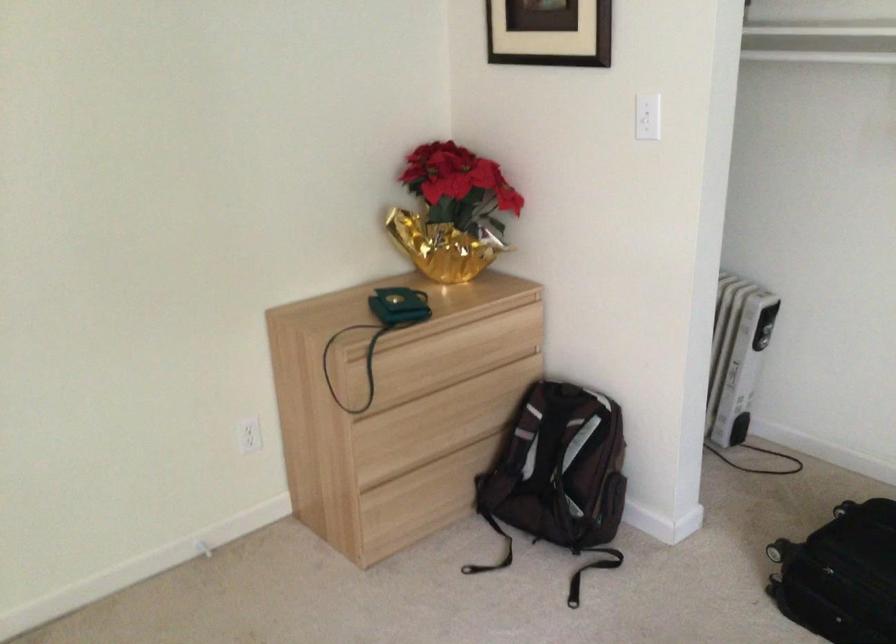
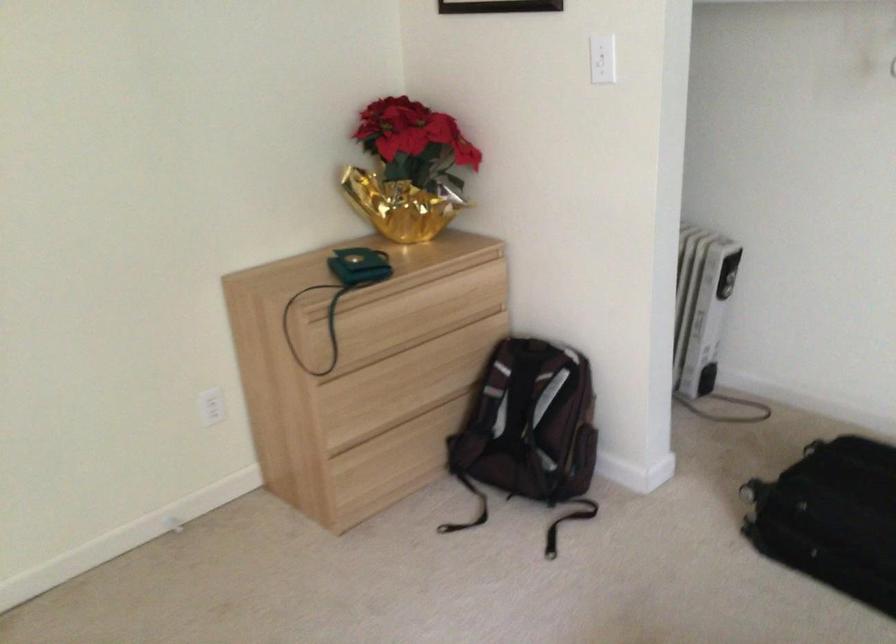
Locate, in the second image, the point that corresponds to point (647, 114) in the first image.

(602, 59)